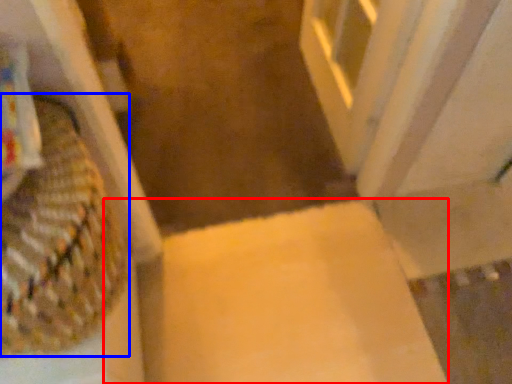
Question: Which object is closer to the camera taking this photo, cardboard box (highlighted by a red box) or basket (highlighted by a blue box)?

Choices:
 (A) cardboard box
 (B) basket

Answer: (B)